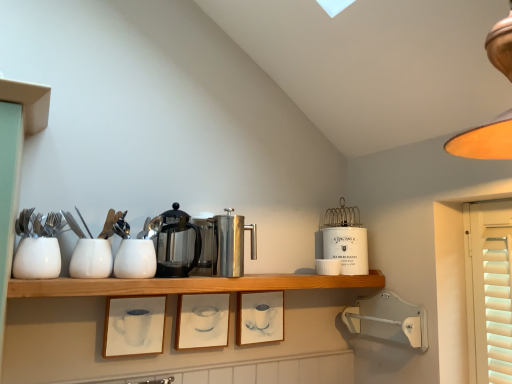
Find the location of a particular element. This screenshot has height=384, width=512. free point to the right of white matte cup at left, which is counted as the 4th tableware, starting from the back is located at coordinates (82, 279).